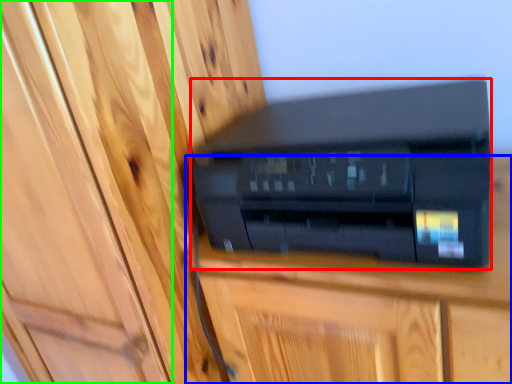
Question: Which is nearer to the printer (highlighted by a red box)? furniture (highlighted by a blue box) or door (highlighted by a green box).

Choices:
 (A) furniture
 (B) door

Answer: (A)